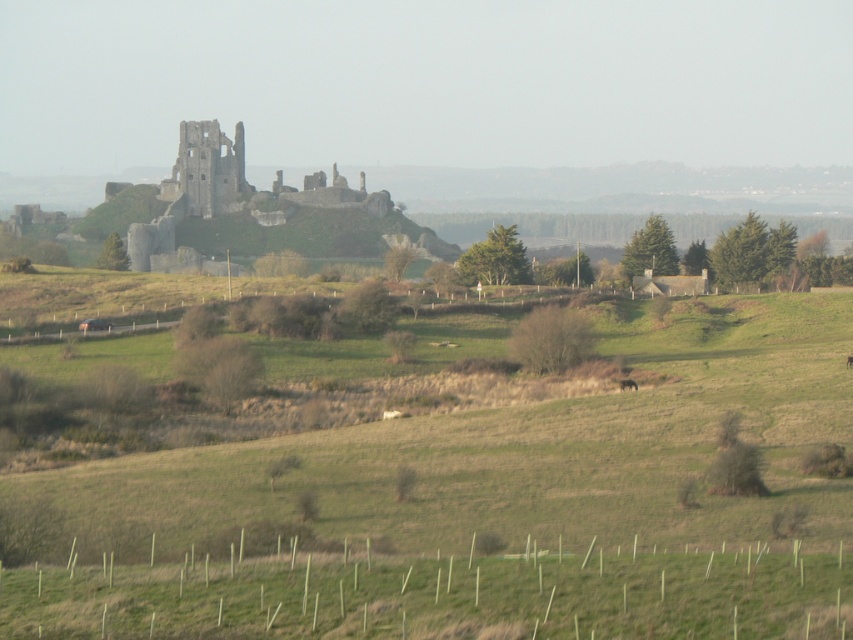
Who is taller, green grassy at lower center or weathered stone castle at center?

With more height is weathered stone castle at center.

Who is more forward, (628, 602) or (390, 209)?

Positioned in front is point (628, 602).

Identify the location of green grassy at lower center. coord(442,598).

Locate an element on the screen. This screenshot has height=640, width=853. green grassy at lower center is located at coordinates (442, 598).

Is weathered stone castle at center smaller than brown furry dog at center-right?

Incorrect, weathered stone castle at center is not smaller in size than brown furry dog at center-right.

Describe the element at coordinates (231, 192) in the screenshot. The height and width of the screenshot is (640, 853). I see `weathered stone castle at center` at that location.

At what (x,y) coordinates should I click in order to perform the action: click on weathered stone castle at center. Please return your answer as a coordinate pair (x, y). This screenshot has width=853, height=640. Looking at the image, I should click on (231, 192).

Can you confirm if green grassy at lower center is positioned above brown furry dog at center-right?

No, green grassy at lower center is not above brown furry dog at center-right.

Does green grassy at lower center have a larger size compared to brown furry dog at center-right?

Correct, green grassy at lower center is larger in size than brown furry dog at center-right.

Find the location of `green grassy at lower center`. green grassy at lower center is located at coordinates (442, 598).